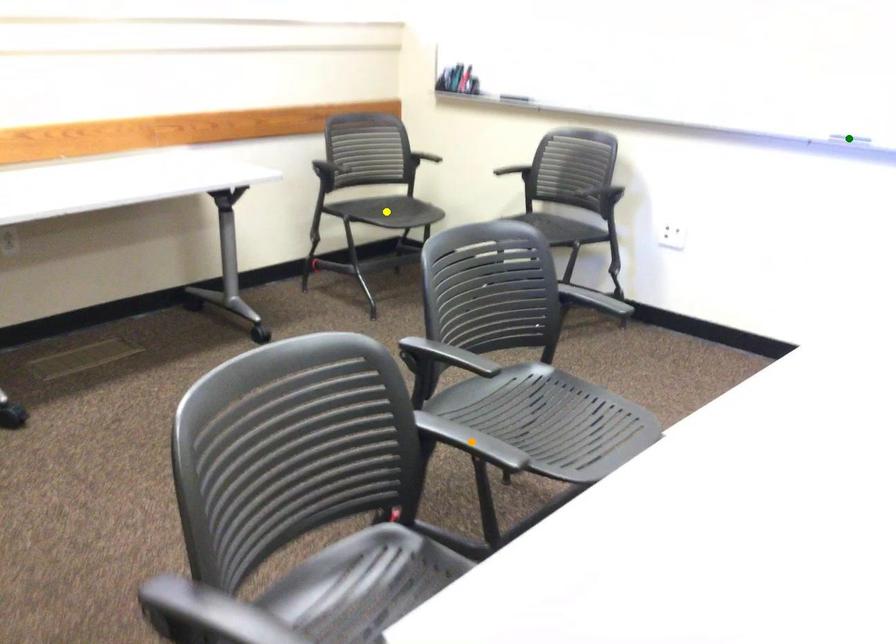
Order these from nearest to farthest:
- orange point
- yellow point
- green point

orange point → green point → yellow point